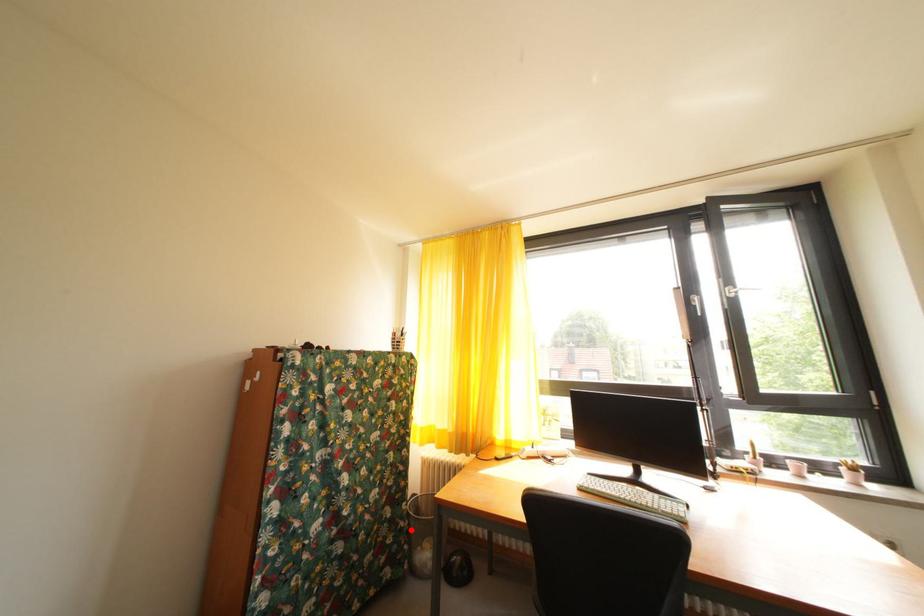
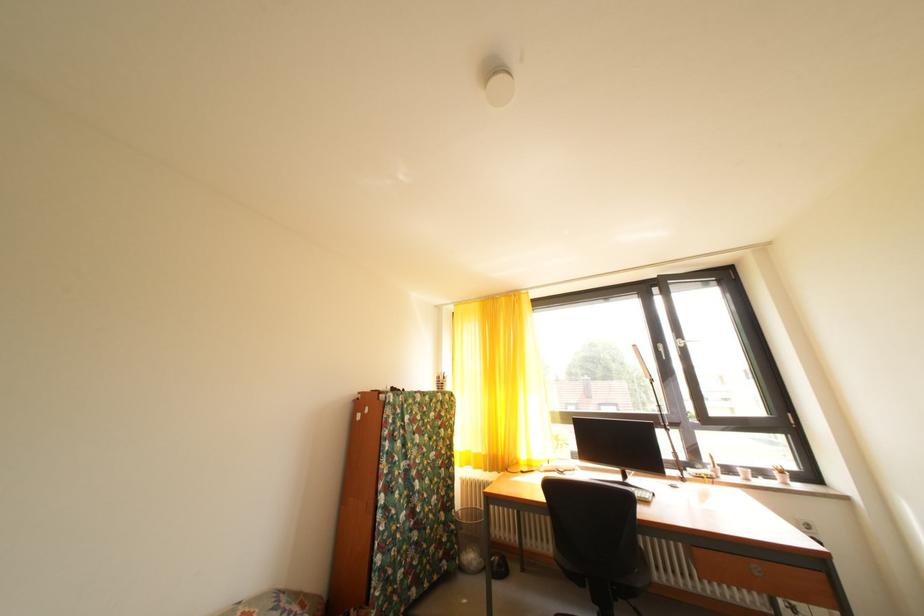
Question: I am providing you with two images of the same scene from different viewpoints. A red point is marked on the first image. Can you still see the location of the red point in image 2?

Choices:
 (A) Yes
 (B) No

Answer: (A)